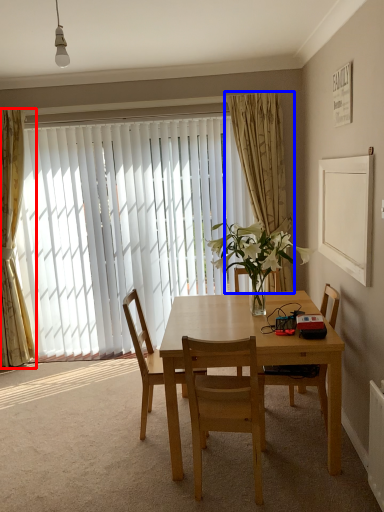
Question: Which object is closer to the camera taking this photo, curtain (highlighted by a red box) or curtain (highlighted by a blue box)?

Choices:
 (A) curtain
 (B) curtain

Answer: (B)